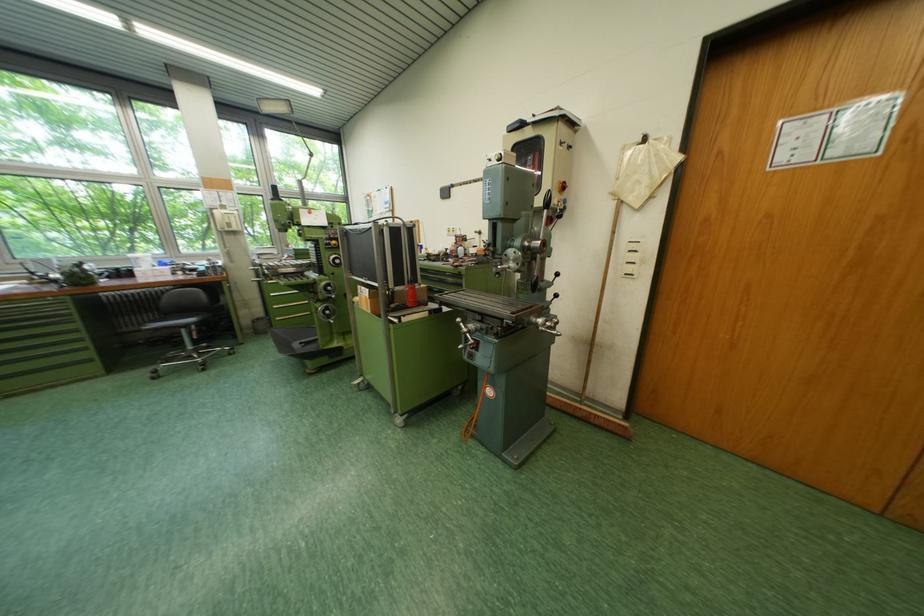
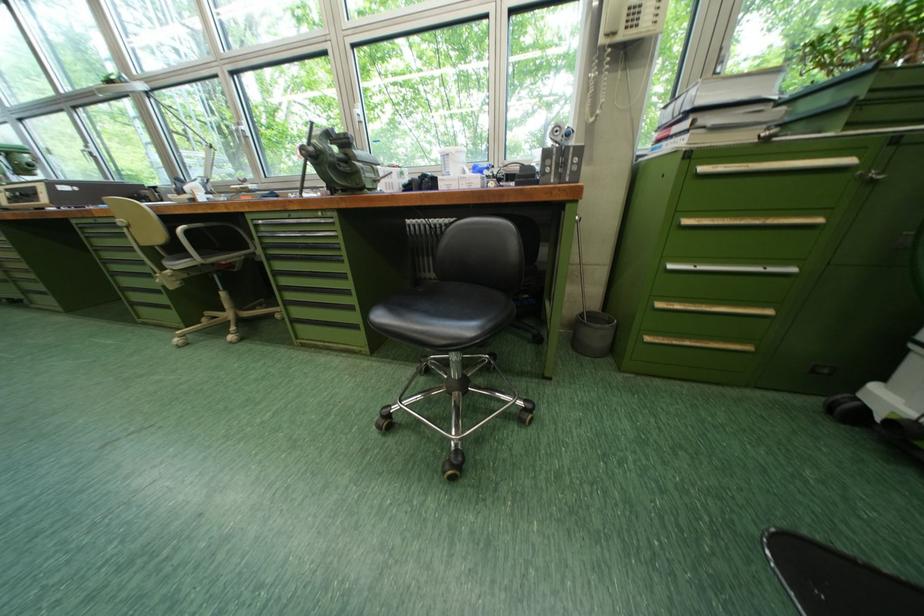
Find the pixel in the second image that matches point (283, 297) in the first image.

(681, 269)